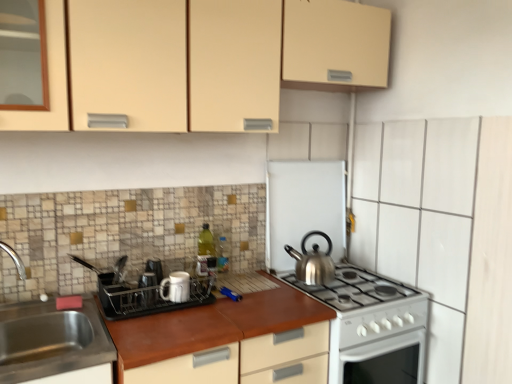
Locate an element on the screen. spots to the right of green glass bottle at center is located at coordinates (238, 283).